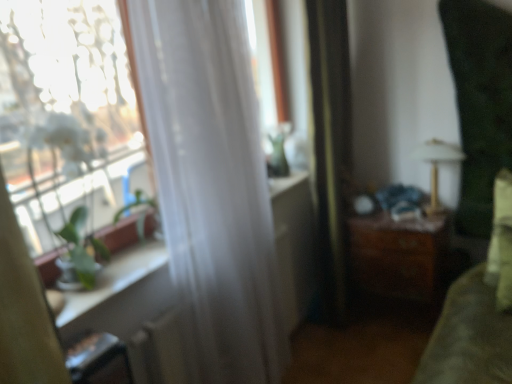
Locate an element on the screen. This screenshot has width=512, height=384. metallic gold lamp at upper right is located at coordinates (436, 166).

I want to click on white sheer curtain at left, so click(122, 293).

Describe the element at coordinates (64, 111) in the screenshot. The height and width of the screenshot is (384, 512). I see `transparent glass window at left` at that location.

At what (x,y) coordinates should I click in order to perform the action: click on metallic gold lamp at upper right. Please return your answer as a coordinate pair (x, y). The width and height of the screenshot is (512, 384). Looking at the image, I should click on [x=436, y=166].

From the image's perspective, which one is positioned lower, wooden chest of drawers at center-right or white sheer curtain at left, marked as the first curtain in a left-to-right arrangement?

From the image's view, wooden chest of drawers at center-right is below.

Is wooden chest of drawers at center-right positioned far away from white sheer curtain at left, marked as the first curtain in a left-to-right arrangement?

wooden chest of drawers at center-right is far away from white sheer curtain at left, marked as the first curtain in a left-to-right arrangement.

Considering the sizes of objects wooden chest of drawers at center-right and white sheer curtain at left, positioned as the 2th curtain in right-to-left order, in the image provided, who is bigger, wooden chest of drawers at center-right or white sheer curtain at left, positioned as the 2th curtain in right-to-left order,?

Bigger between the two is white sheer curtain at left, positioned as the 2th curtain in right-to-left order.

Measure the distance from wooden chest of drawers at center-right to transparent glass window at left.

wooden chest of drawers at center-right and transparent glass window at left are 5.06 feet apart from each other.

The image size is (512, 384). I want to click on window above the wooden chest of drawers at center-right (from the image's perspective), so point(64,111).

Is wooden chest of drawers at center-right positioned beyond the bounds of transparent glass window at left?

Yes, wooden chest of drawers at center-right is outside of transparent glass window at left.

In terms of size, does white sheer curtain at left, marked as the first curtain in a left-to-right arrangement, appear bigger or smaller than white sheer curtain at left?

white sheer curtain at left, marked as the first curtain in a left-to-right arrangement, is bigger than white sheer curtain at left.

Considering the relative positions of white sheer curtain at left, positioned as the 2th curtain in right-to-left order, and white sheer curtain at left in the image provided, is white sheer curtain at left, positioned as the 2th curtain in right-to-left order, to the left or to the right of white sheer curtain at left?

white sheer curtain at left, positioned as the 2th curtain in right-to-left order, is to the right of white sheer curtain at left.

Between white sheer curtain at left, positioned as the 2th curtain in right-to-left order, and white sheer curtain at left, which one has less height?

With less height is white sheer curtain at left.

Measure the distance from white sheer curtain at left, marked as the first curtain in a left-to-right arrangement, to white sheer curtain at left.

33.99 inches.

In the image, there is a white sheer curtain at left. In order to click on window above it (from the image's perspective) in this screenshot , I will do `click(64, 111)`.

Based on the photo, is white sheer curtain at left turned away from transparent glass window at left?

No, white sheer curtain at left is not facing the opposite direction of transparent glass window at left.

Who is bigger, white sheer curtain at left or transparent glass window at left?

With larger size is transparent glass window at left.

How different are the orientations of white sheer curtain at left, marked as the first curtain in a left-to-right arrangement, and wooden chest of drawers at center-right in degrees?

They differ by 89.5 degrees in their facing directions.

Considering the relative positions of white sheer curtain at left, marked as the first curtain in a left-to-right arrangement, and wooden chest of drawers at center-right in the image provided, is white sheer curtain at left, marked as the first curtain in a left-to-right arrangement, behind wooden chest of drawers at center-right?

No.

Is white sheer curtain at left, positioned as the 2th curtain in right-to-left order, in contact with wooden chest of drawers at center-right?

No, white sheer curtain at left, positioned as the 2th curtain in right-to-left order, is not making contact with wooden chest of drawers at center-right.

From the image's perspective, is white sheer curtain at left, marked as the first curtain in a left-to-right arrangement, located beneath wooden chest of drawers at center-right?

Incorrect, from the image's perspective, white sheer curtain at left, marked as the first curtain in a left-to-right arrangement, is higher than wooden chest of drawers at center-right.

Does transparent glass window at left have a larger size compared to white sheer curtain at left, marked as the first curtain in a left-to-right arrangement?

No, transparent glass window at left is not bigger than white sheer curtain at left, marked as the first curtain in a left-to-right arrangement.

Considering the sizes of transparent glass window at left and white sheer curtain at left, marked as the first curtain in a left-to-right arrangement, in the image, is transparent glass window at left taller or shorter than white sheer curtain at left, marked as the first curtain in a left-to-right arrangement,?

transparent glass window at left is shorter than white sheer curtain at left, marked as the first curtain in a left-to-right arrangement.

Do you think transparent glass window at left is within white sheer curtain at left, positioned as the 2th curtain in right-to-left order, or outside of it?

transparent glass window at left exists outside the volume of white sheer curtain at left, positioned as the 2th curtain in right-to-left order.

You are a GUI agent. You are given a task and a screenshot of the screen. Output one action in this format:
    pyautogui.click(x=<x>, y=<y>)
    Task: Click on the window on the left of the white sheer curtain at left, marked as the first curtain in a left-to-right arrangement
    The width and height of the screenshot is (512, 384).
    Given the screenshot: What is the action you would take?
    pyautogui.click(x=64, y=111)

Who is smaller, silky black curtain at center, positioned as the second curtain in left-to-right order, or white sheer curtain at left?

Smaller between the two is white sheer curtain at left.

Is silky black curtain at center, the first curtain in the right-to-left sequence, placed right next to white sheer curtain at left?

No, silky black curtain at center, the first curtain in the right-to-left sequence, is not next to white sheer curtain at left.

Which object is positioned more to the right, silky black curtain at center, the first curtain in the right-to-left sequence, or white sheer curtain at left?

Positioned to the right is silky black curtain at center, the first curtain in the right-to-left sequence.

Is silky black curtain at center, the first curtain in the right-to-left sequence, oriented towards white sheer curtain at left?

No, silky black curtain at center, the first curtain in the right-to-left sequence, does not turn towards white sheer curtain at left.

Find the location of a particular element. table located underneath the white sheer curtain at left, positioned as the 2th curtain in right-to-left order (from a real-world perspective) is located at coordinates (400, 255).

This screenshot has height=384, width=512. Find the location of `table on the right of transparent glass window at left`. table on the right of transparent glass window at left is located at coordinates (400, 255).

Looking at the image, which one is located closer to white sheer curtain at left, positioned as the 2th curtain in right-to-left order, metallic gold lamp at upper right or wooden chest of drawers at center-right?

Among the two, wooden chest of drawers at center-right is located nearer to white sheer curtain at left, positioned as the 2th curtain in right-to-left order.

Considering their positions, is metallic gold lamp at upper right positioned further to white sheer curtain at left, positioned as the 2th curtain in right-to-left order, than transparent glass window at left?

Among the two, metallic gold lamp at upper right is located further to white sheer curtain at left, positioned as the 2th curtain in right-to-left order.

From the image, which object appears to be farther from silky black curtain at center, positioned as the second curtain in left-to-right order, white sheer curtain at left, marked as the first curtain in a left-to-right arrangement, or white sheer curtain at left?

white sheer curtain at left, marked as the first curtain in a left-to-right arrangement, is further to silky black curtain at center, positioned as the second curtain in left-to-right order.

Estimate the real-world distances between objects in this image. Which object is closer to white sheer curtain at left, metallic gold lamp at upper right or transparent glass window at left?

The object closer to white sheer curtain at left is metallic gold lamp at upper right.

From the image, which object appears to be nearer to transparent glass window at left, wooden chest of drawers at center-right or metallic gold lamp at upper right?

Among the two, wooden chest of drawers at center-right is located nearer to transparent glass window at left.

Based on their spatial positions, is wooden chest of drawers at center-right or white sheer curtain at left closer to silky black curtain at center, the first curtain in the right-to-left sequence?

The object closer to silky black curtain at center, the first curtain in the right-to-left sequence, is white sheer curtain at left.

Consider the image. Estimate the real-world distances between objects in this image. Which object is closer to white sheer curtain at left, positioned as the 2th curtain in right-to-left order, transparent glass window at left or white sheer curtain at left?

The object closer to white sheer curtain at left, positioned as the 2th curtain in right-to-left order, is transparent glass window at left.

From the image, which object appears to be nearer to wooden chest of drawers at center-right, white sheer curtain at left or silky black curtain at center, positioned as the second curtain in left-to-right order?

Based on the image, silky black curtain at center, positioned as the second curtain in left-to-right order, appears to be nearer to wooden chest of drawers at center-right.

Image resolution: width=512 pixels, height=384 pixels. I want to click on window sill between transparent glass window at left and wooden chest of drawers at center-right, so click(122, 293).

The width and height of the screenshot is (512, 384). In order to click on lamp located between white sheer curtain at left, marked as the first curtain in a left-to-right arrangement, and wooden chest of drawers at center-right in the depth direction in this screenshot , I will do `click(436, 166)`.

The height and width of the screenshot is (384, 512). Identify the location of curtain between transparent glass window at left and silky black curtain at center, the first curtain in the right-to-left sequence. (212, 184).

Identify the location of window sill between white sheer curtain at left, positioned as the 2th curtain in right-to-left order, and silky black curtain at center, positioned as the second curtain in left-to-right order, in the front-back direction. (122, 293).